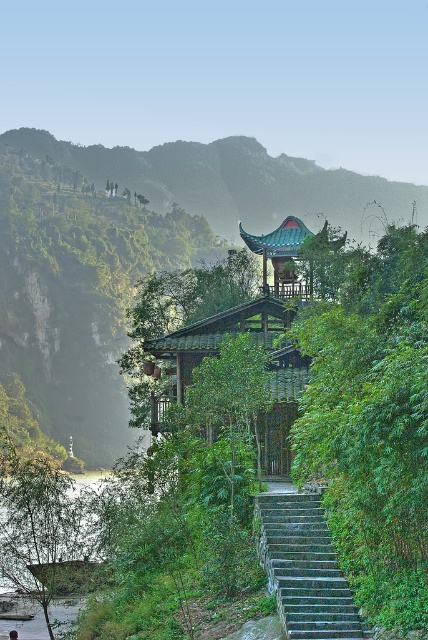
You are standing at the base of the stone steps at center and want to reach the pavilion. There is a green leafy bush at center blocking your path. Which direction should you move to go around it and continue towards the pavilion?

The green leafy bush at center is to the right of stone steps at center, so you should move to the left to go around the bush and continue towards the pavilion.